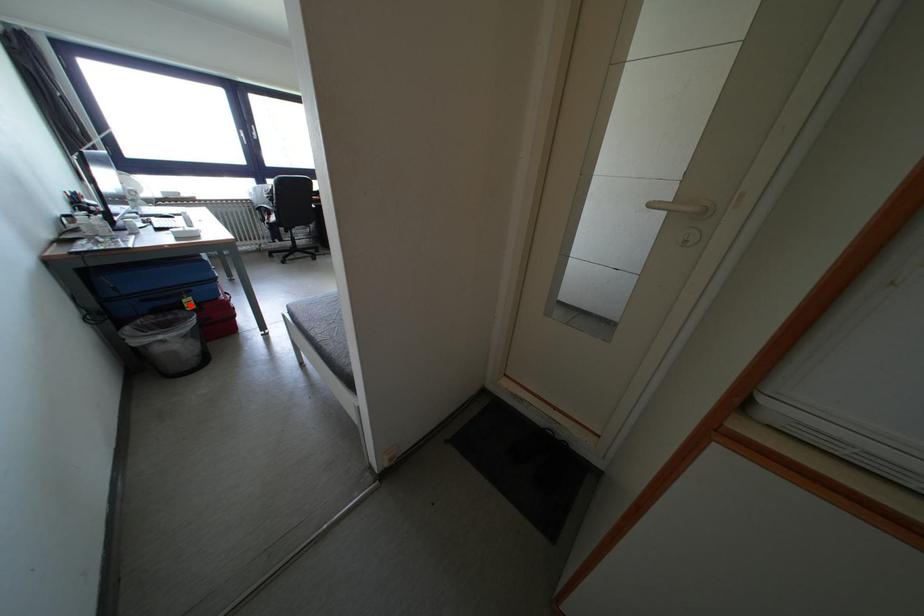
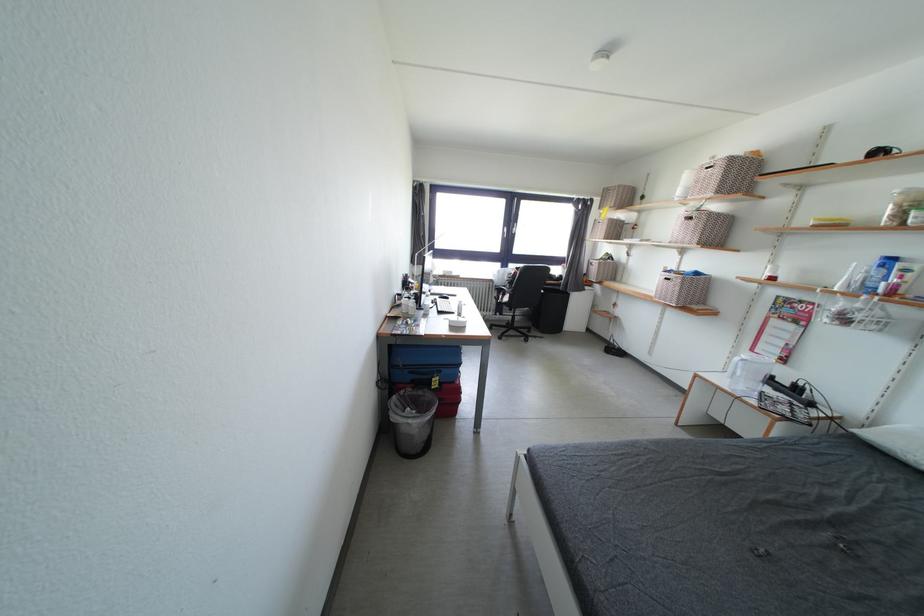
In the second image, find the point that corresponds to the highlighted location in the first image.

(440, 384)